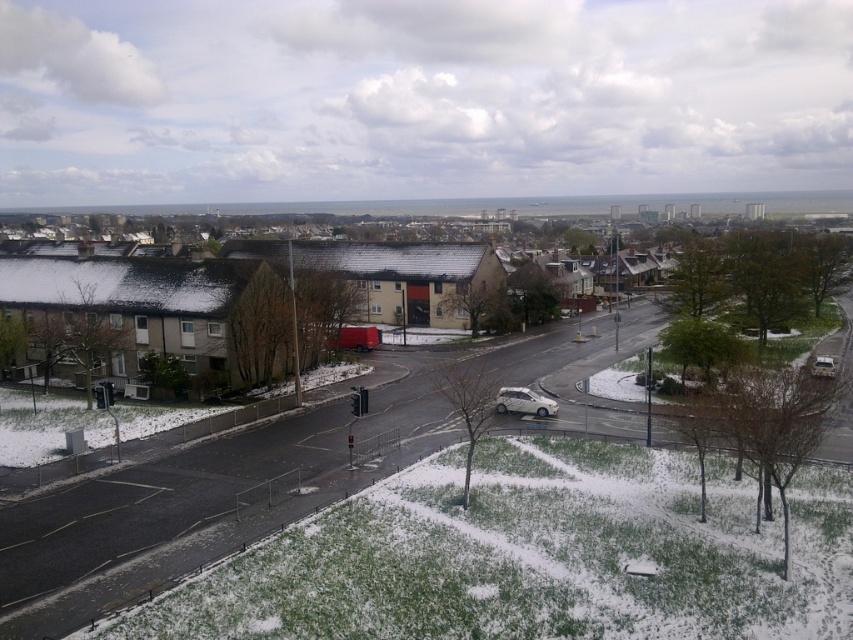
You are a delivery driver needing to park your vehicle in a space that can only accommodate vehicles up to the size of the white matte car at center. Can your matte red truck at center fit into this space?

The matte red truck at center is wider than the white matte car at center, so it cannot fit into the parking space designed for vehicles up to the size of the white matte car at center.

You are driving a delivery van that is 20 feet long and need to park between the matte red truck at center and the white matte car at center. Is there enough space between them to park your van without overlapping either vehicle?

The distance between the matte red truck at center and the white matte car at center is 42.52 feet. Since your van is 20 feet long, there is sufficient space to park between them without overlapping either vehicle.

You are a delivery driver who needs to park your vehicle between the matte red truck at center and the white matte car at center. Which side of the parking spot should you choose to ensure you are positioned between them?

You should park to the right of the matte red truck at center because it is to the left of the white matte car at center, so placing your vehicle between them would require positioning it to the right of the matte red truck at center and to the left of the white matte car at center.